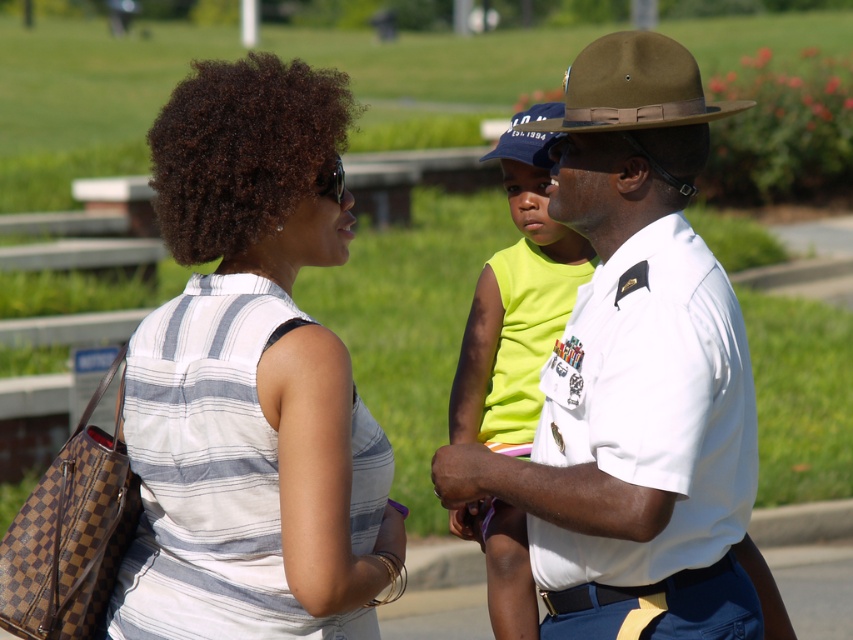
Question: Which object appears closest to the camera in this image?

Choices:
 (A) brown leather cowboy hat at upper center
 (B) neon yellow sleeveless shirt at center
 (C) white uniform at center
 (D) blue fabric baseball cap at center

Answer: (C)

Question: Which point is farther to the camera?

Choices:
 (A) brown leather cowboy hat at upper center
 (B) white striped shirt at center
 (C) blue fabric baseball cap at center

Answer: (C)

Question: Which object is closer to the camera taking this photo?

Choices:
 (A) blue fabric baseball cap at center
 (B) neon yellow sleeveless shirt at center
 (C) white striped shirt at center
 (D) brown leather cowboy hat at upper center

Answer: (C)

Question: Can you confirm if white striped shirt at center is positioned below neon yellow sleeveless shirt at center?

Choices:
 (A) yes
 (B) no

Answer: (B)

Question: From the image, what is the correct spatial relationship of white striped shirt at center in relation to white uniform at center?

Choices:
 (A) right
 (B) left

Answer: (B)

Question: Is white striped shirt at center bigger than white uniform at center?

Choices:
 (A) no
 (B) yes

Answer: (A)